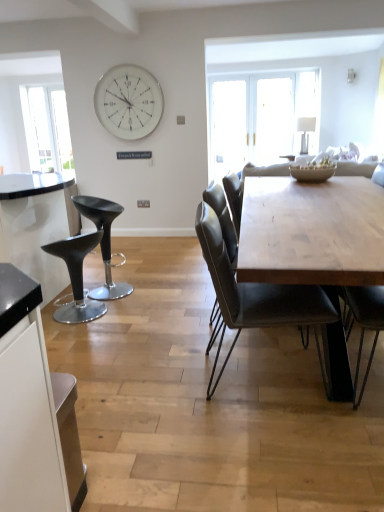
Question: From the image's perspective, does porcelain textured bowl at center appear lower than black leather stool at left, the 2th stool when ordered from back to front?

Choices:
 (A) yes
 (B) no

Answer: (B)

Question: Does porcelain textured bowl at center have a greater width compared to black leather stool at left, positioned as the 1th stool in front-to-back order?

Choices:
 (A) yes
 (B) no

Answer: (B)

Question: From a real-world perspective, does porcelain textured bowl at center sit lower than black leather stool at left, positioned as the 1th stool in front-to-back order?

Choices:
 (A) yes
 (B) no

Answer: (B)

Question: Is porcelain textured bowl at center taller than black leather stool at left, positioned as the 1th stool in front-to-back order?

Choices:
 (A) no
 (B) yes

Answer: (A)

Question: Is porcelain textured bowl at center further to camera compared to black leather stool at left, the 2th stool when ordered from back to front?

Choices:
 (A) yes
 (B) no

Answer: (A)

Question: Is black leather stool at left, the 2th stool when ordered from back to front, wider or thinner than transparent glass window at left?

Choices:
 (A) thin
 (B) wide

Answer: (B)

Question: Is black leather stool at left, positioned as the 1th stool in front-to-back order, bigger or smaller than transparent glass window at left?

Choices:
 (A) small
 (B) big

Answer: (B)

Question: Is black leather stool at left, positioned as the 1th stool in front-to-back order, taller or shorter than transparent glass window at left?

Choices:
 (A) short
 (B) tall

Answer: (A)

Question: From the image's perspective, is black leather stool at left, positioned as the 1th stool in front-to-back order, above or below transparent glass window at left?

Choices:
 (A) below
 (B) above

Answer: (A)

Question: Considering the positions of black leather stool at left, positioned as the 1th stool in front-to-back order, and matte black stool at left, arranged as the first stool when viewed from the back, in the image, is black leather stool at left, positioned as the 1th stool in front-to-back order, wider or thinner than matte black stool at left, arranged as the first stool when viewed from the back,?

Choices:
 (A) thin
 (B) wide

Answer: (A)

Question: In the image, is black leather stool at left, the 2th stool when ordered from back to front, positioned in front of or behind matte black stool at left, which is counted as the 2th stool, starting from the front?

Choices:
 (A) behind
 (B) front

Answer: (B)

Question: Considering the positions of point (97, 230) and point (105, 242), is point (97, 230) closer or farther from the camera than point (105, 242)?

Choices:
 (A) farther
 (B) closer

Answer: (B)

Question: Is black leather stool at left, the 2th stool when ordered from back to front, situated inside matte black stool at left, arranged as the first stool when viewed from the back, or outside?

Choices:
 (A) outside
 (B) inside

Answer: (A)

Question: Choose the correct answer: Is porcelain textured bowl at center inside leather seat at center or outside it?

Choices:
 (A) outside
 (B) inside

Answer: (A)

Question: Considering the positions of porcelain textured bowl at center and leather seat at center in the image, is porcelain textured bowl at center taller or shorter than leather seat at center?

Choices:
 (A) tall
 (B) short

Answer: (B)